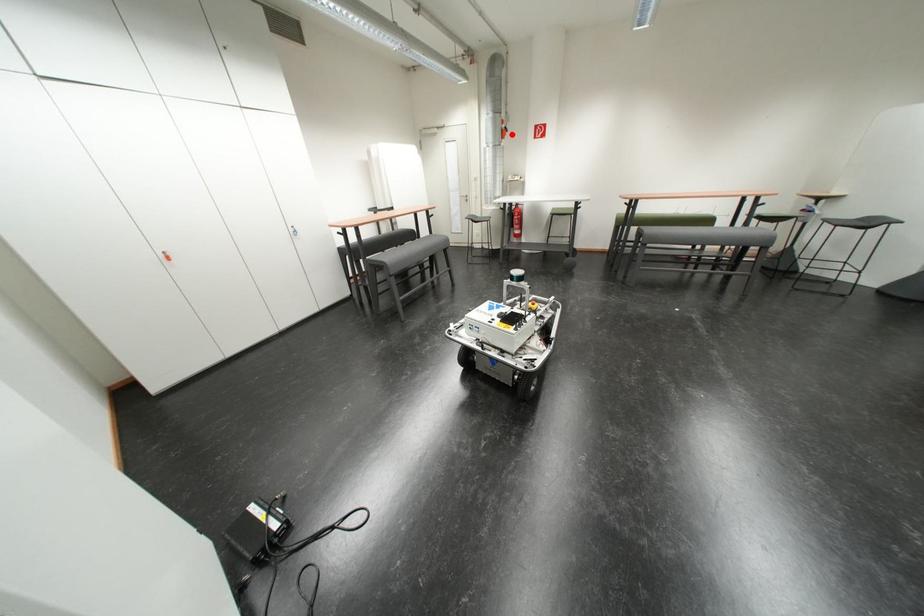
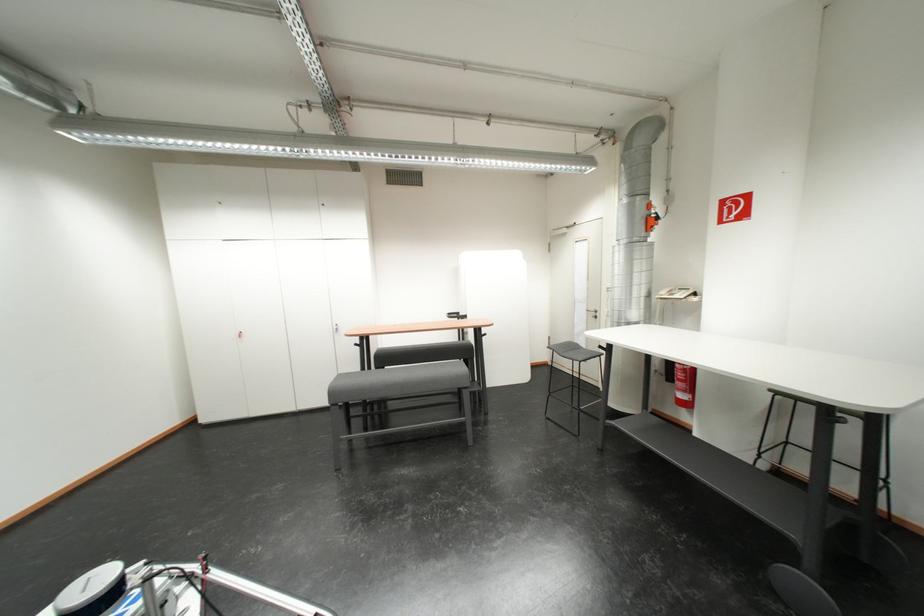
Question: I am providing you with two images of the same scene from different viewpoints. Given a red point in image1, look at the same physical point in image2. Is it:

Choices:
 (A) Closer to the viewpoint
 (B) Farther from the viewpoint

Answer: (B)